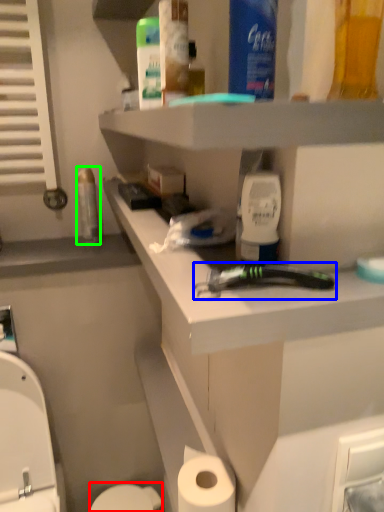
Question: Estimate the real-world distances between objects in this image. Which object is closer to toilet bowl (highlighted by a red box), tool (highlighted by a blue box) or mouthwash (highlighted by a green box)?

Choices:
 (A) tool
 (B) mouthwash

Answer: (B)